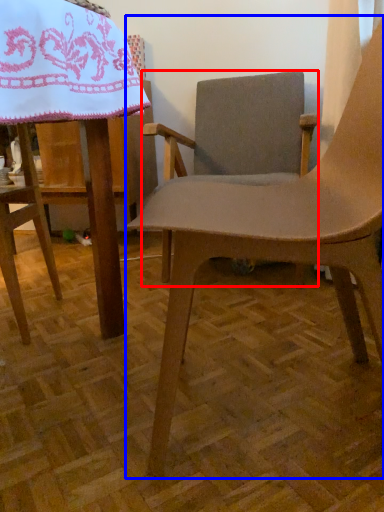
Question: Which object is closer to the camera taking this photo, chair (highlighted by a red box) or chair (highlighted by a blue box)?

Choices:
 (A) chair
 (B) chair

Answer: (B)